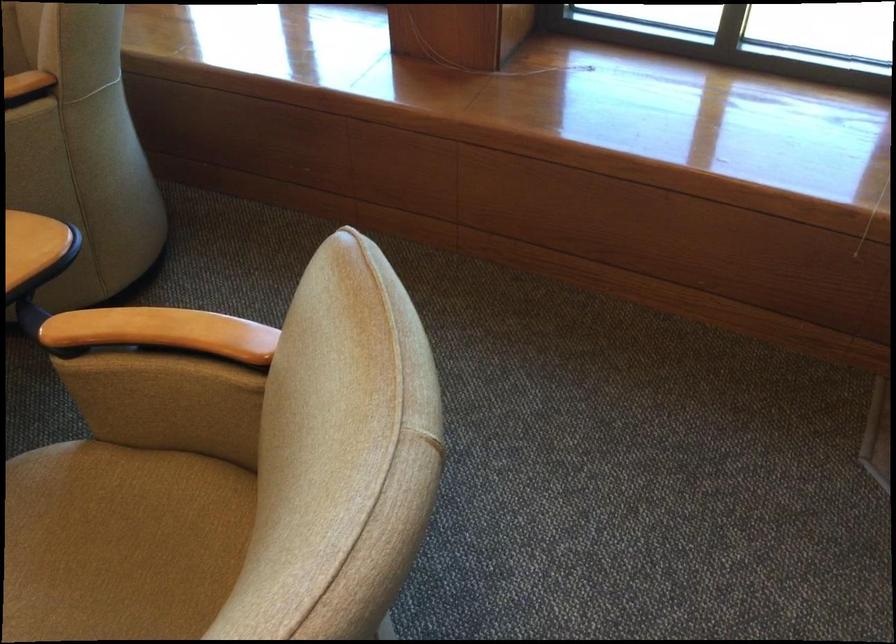
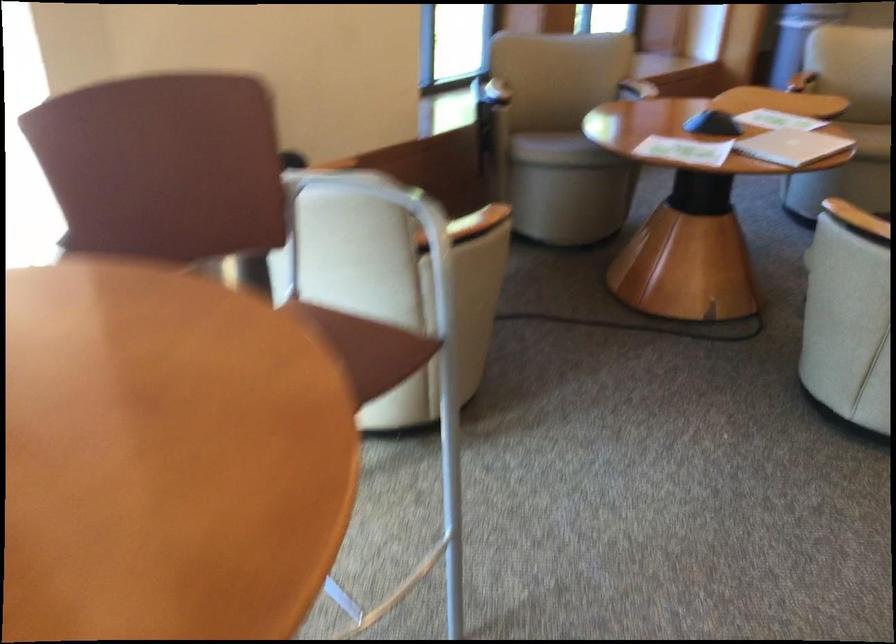
Question: I am providing you with two images of the same scene from different viewpoints. After the viewpoint changes to image2, which objects are now occluded?

Choices:
 (A) patterned changing pad
 (B) wooden chair armrest
 (C) tan chair sitting surface
 (D) beige chair sitting surface

Answer: (C)